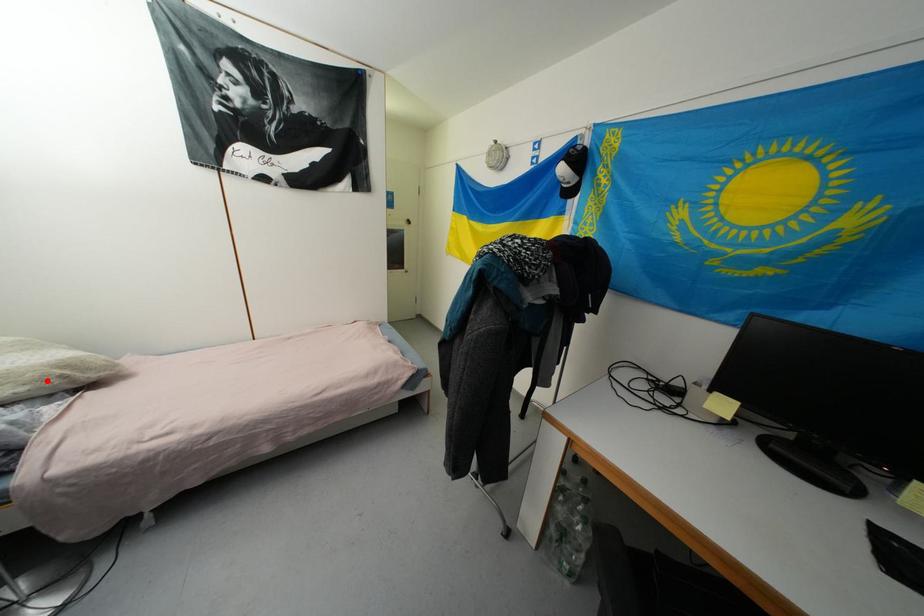
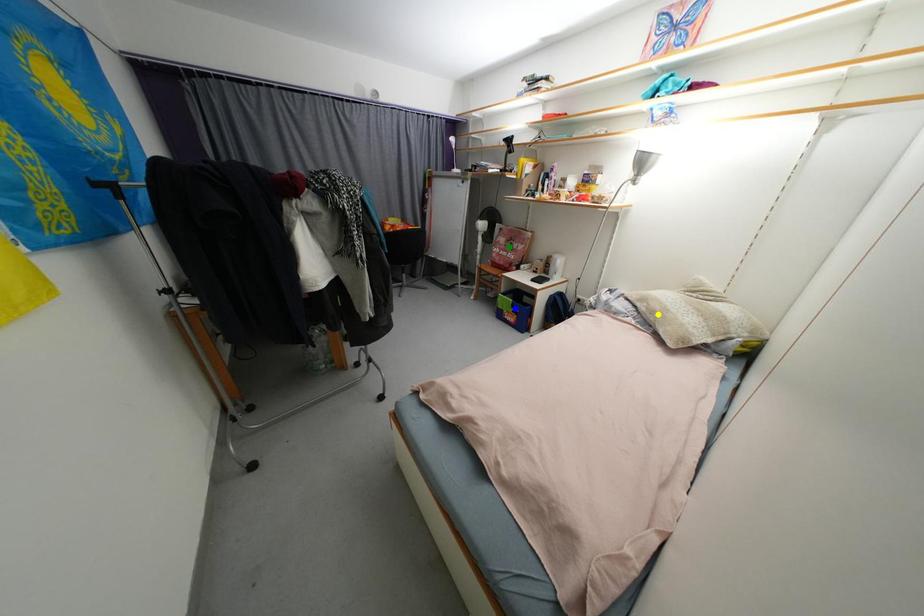
Question: I am providing you with two images of the same scene from different viewpoints. A red point is marked on the first image. You are given multiple points on the second image. Which spot in image 2 lines up with the point in image 1?

Choices:
 (A) green point
 (B) yellow point
 (C) blue point

Answer: (B)